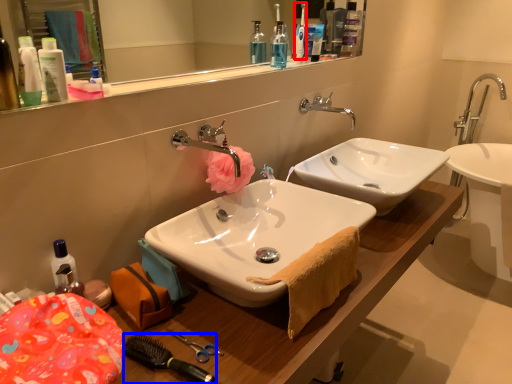
Question: Among these objects, which one is nearest to the camera, toothbrush (highlighted by a red box) or brush (highlighted by a blue box)?

Choices:
 (A) toothbrush
 (B) brush

Answer: (B)